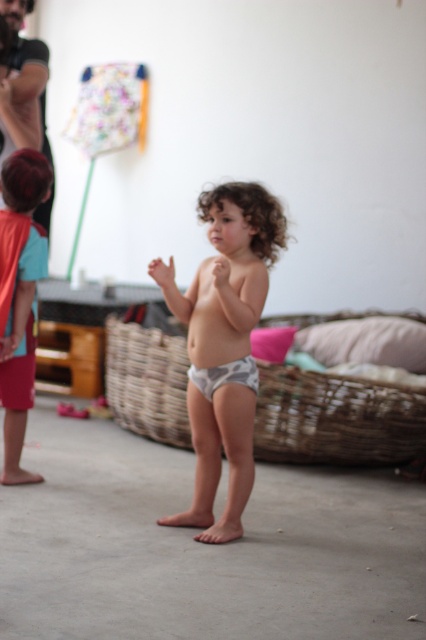
Question: Which object is the closest to the gray fabric diaper at center?

Choices:
 (A) matte red shorts at left
 (B) gray-patterned diaper at center

Answer: (B)

Question: Where is gray-patterned diaper at center located in relation to gray fabric diaper at center in the image?

Choices:
 (A) below
 (B) above

Answer: (B)

Question: Considering the relative positions of gray-patterned diaper at center and matte red shorts at left in the image provided, where is gray-patterned diaper at center located with respect to matte red shorts at left?

Choices:
 (A) above
 (B) below

Answer: (B)

Question: Among these points, which one is farthest from the camera?

Choices:
 (A) (5, 195)
 (B) (198, 468)

Answer: (A)

Question: Does gray-patterned diaper at center appear under gray fabric diaper at center?

Choices:
 (A) no
 (B) yes

Answer: (A)

Question: Based on their relative distances, which object is farther from the matte red shorts at left?

Choices:
 (A) gray fabric diaper at center
 (B) gray-patterned diaper at center

Answer: (A)